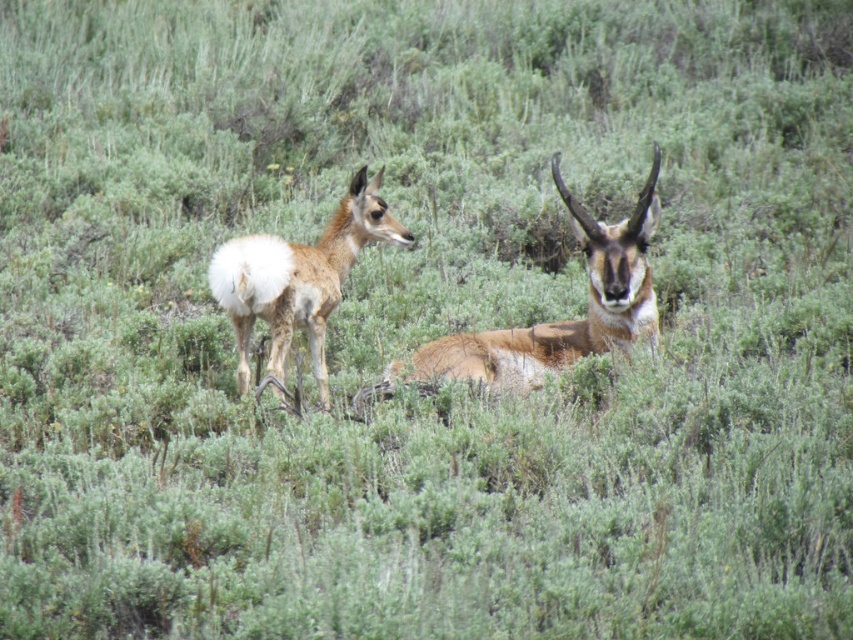
Question: Which of the following is the farthest from the observer?

Choices:
 (A) (595, 262)
 (B) (270, 294)

Answer: (A)

Question: Is brown fuzzy antelope at center to the right of brown fur antelope at center from the viewer's perspective?

Choices:
 (A) no
 (B) yes

Answer: (B)

Question: Does brown fuzzy antelope at center have a greater width compared to brown fur antelope at center?

Choices:
 (A) yes
 (B) no

Answer: (A)

Question: Considering the relative positions of brown fuzzy antelope at center and brown fur antelope at center in the image provided, where is brown fuzzy antelope at center located with respect to brown fur antelope at center?

Choices:
 (A) above
 (B) below

Answer: (B)

Question: Which object is closer to the camera taking this photo?

Choices:
 (A) brown fur antelope at center
 (B) brown fuzzy antelope at center

Answer: (A)